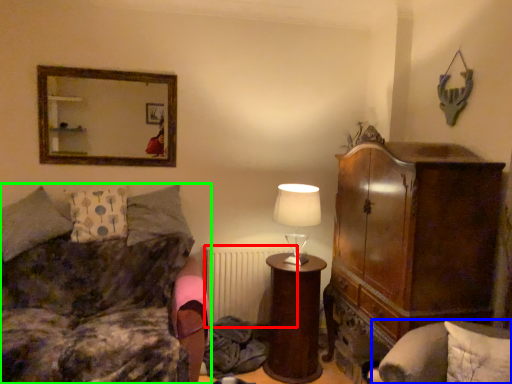
Question: Which object is positioned farthest from radiator (highlighted by a red box)? Select from swivel chair (highlighted by a blue box) and studio couch (highlighted by a green box).

Choices:
 (A) swivel chair
 (B) studio couch

Answer: (A)